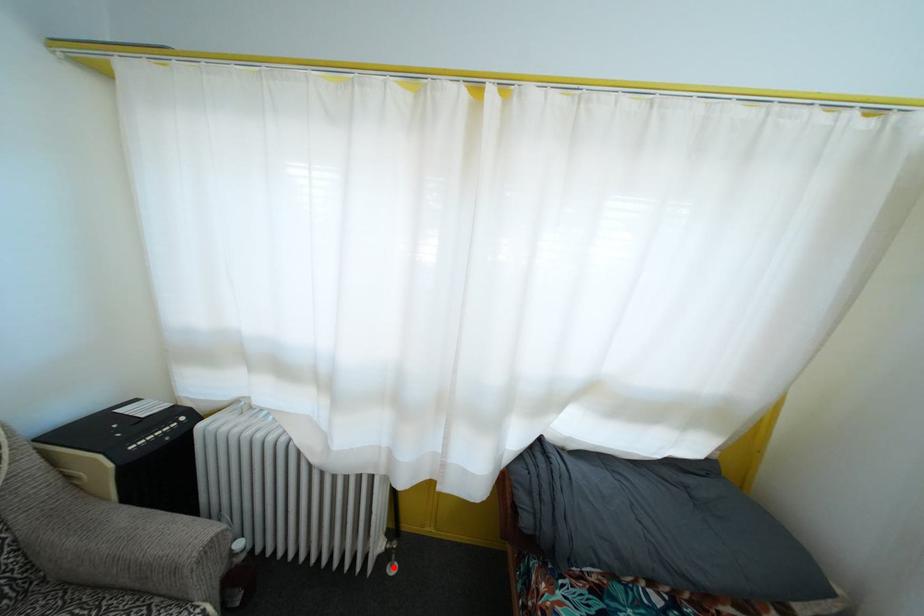
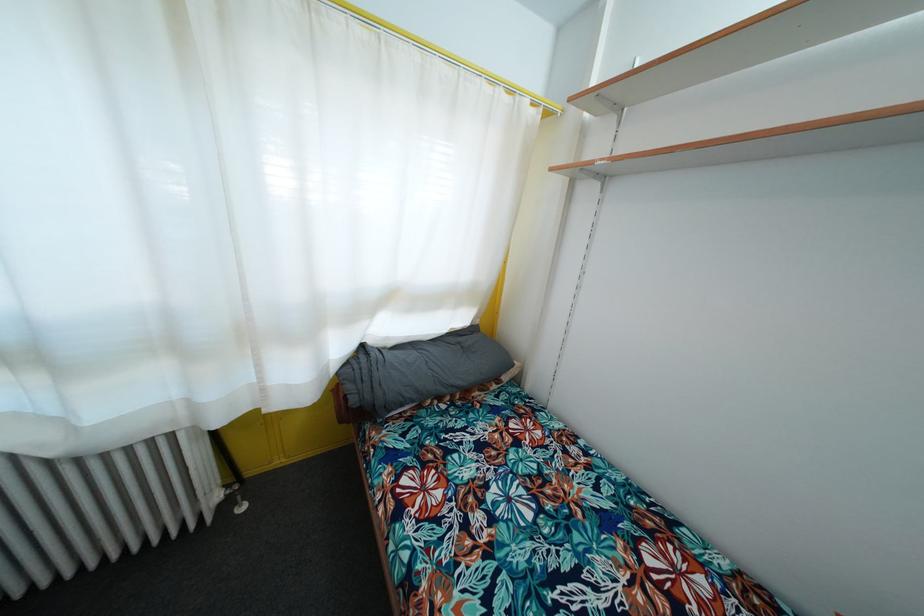
Question: A red point is marked in image1. In image2, is the corresponding 3D point closer to the camera or farther? Reply with the corresponding letter.

Choices:
 (A) The corresponding 3D point is closer.
 (B) The corresponding 3D point is farther.

Answer: (A)